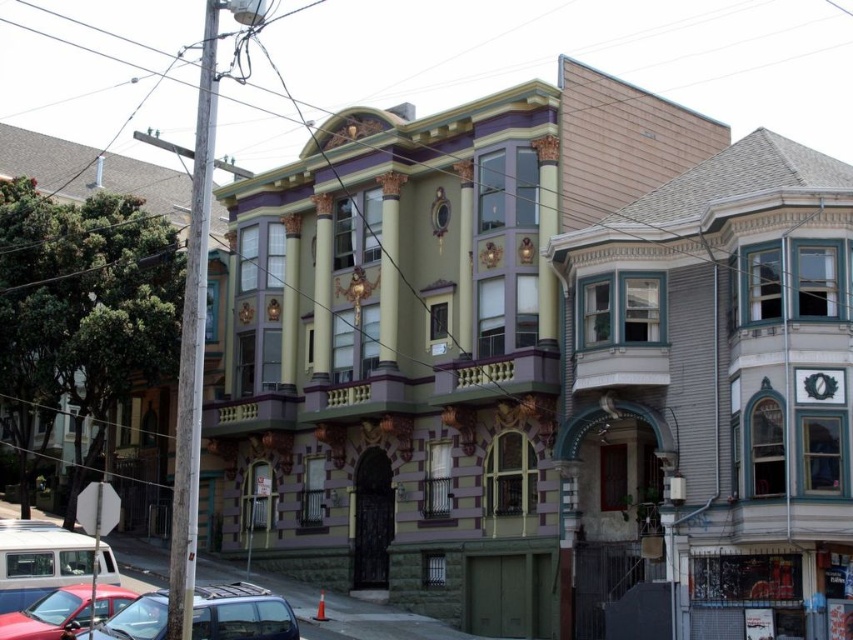
Question: Does shiny black car at lower left appear over shiny red car at lower left?

Choices:
 (A) no
 (B) yes

Answer: (A)

Question: Which object is closer to the camera taking this photo?

Choices:
 (A) shiny black car at lower left
 (B) shiny red car at lower left

Answer: (A)

Question: Is the position of shiny black car at lower left less distant than that of shiny red car at lower left?

Choices:
 (A) yes
 (B) no

Answer: (A)

Question: Which of the following is the farthest from the observer?

Choices:
 (A) (96, 589)
 (B) (221, 632)

Answer: (A)

Question: Does shiny black car at lower left have a larger size compared to shiny red car at lower left?

Choices:
 (A) yes
 (B) no

Answer: (A)

Question: Which object appears farthest from the camera in this image?

Choices:
 (A) shiny black car at lower left
 (B) shiny red car at lower left

Answer: (B)